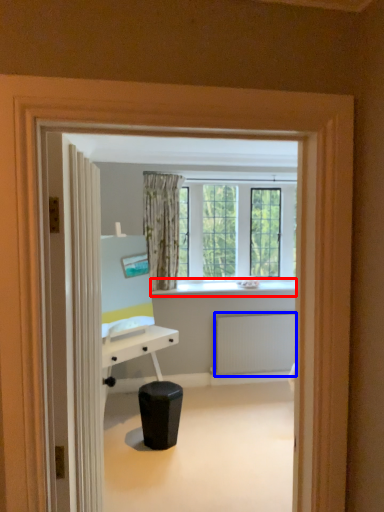
Question: Which of the following is the closest to the observer, window sill (highlighted by a red box) or radiator (highlighted by a blue box)?

Choices:
 (A) window sill
 (B) radiator

Answer: (A)